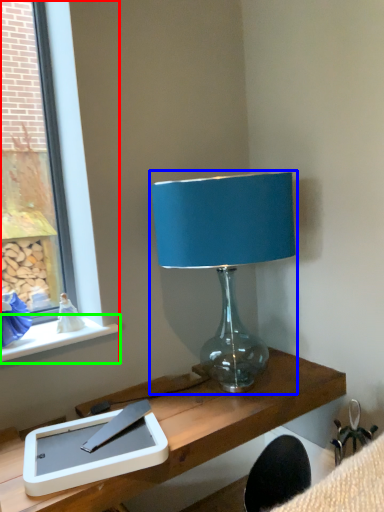
Question: Considering the real-world distances, which object is farthest from window (highlighted by a red box)? lamp (highlighted by a blue box) or window sill (highlighted by a green box)?

Choices:
 (A) lamp
 (B) window sill

Answer: (A)